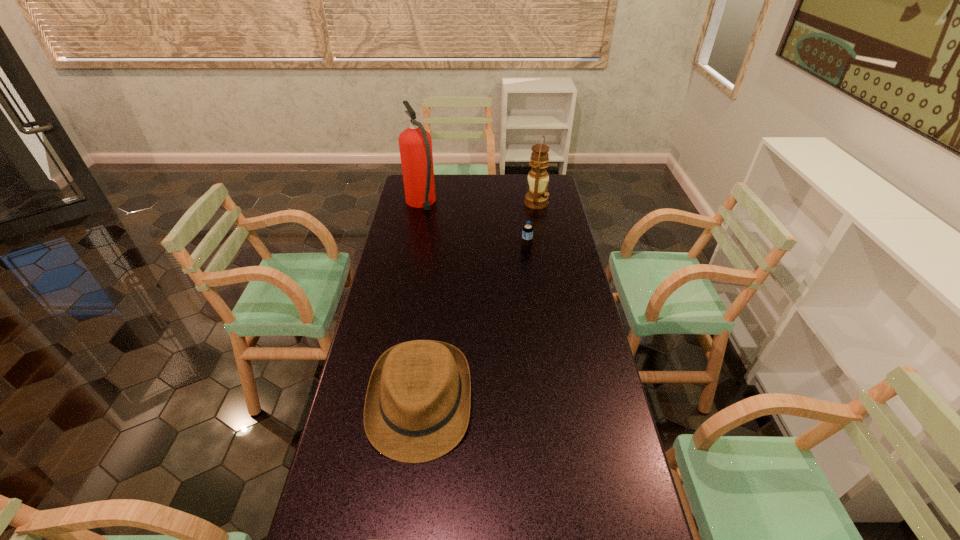
You are a GUI agent. You are given a task and a screenshot of the screen. Output one action in this format:
    pyautogui.click(x=<x>, y=<y>)
    Task: Click on the vacant region that satisfies the following two spatial constraints: 1. on the handle side of the second tallest object; 2. on the right side of the tallest object
    Image resolution: width=960 pixels, height=540 pixels.
    Given the screenshot: What is the action you would take?
    pyautogui.click(x=421, y=204)